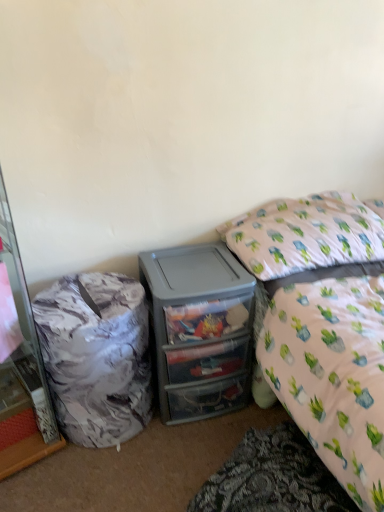
The image size is (384, 512). In order to click on blank space above marble-patterned trash can at left (from a real-world perspective) in this screenshot , I will do `click(74, 293)`.